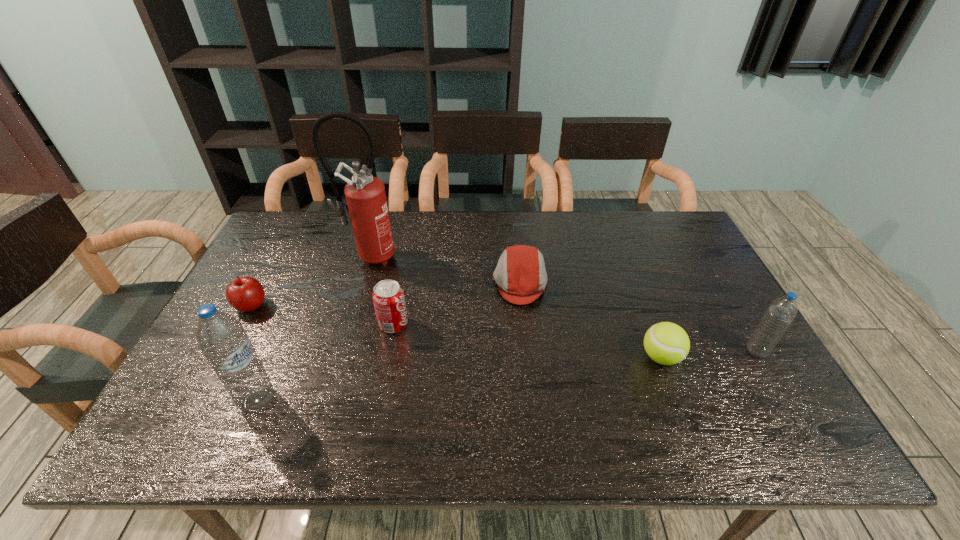
Where is `free space between the apple and the fire extinguisher`? free space between the apple and the fire extinguisher is located at coordinates (310, 281).

Locate an element on the screen. The height and width of the screenshot is (540, 960). free area in between the soda and the fifth object from left to right is located at coordinates (457, 303).

Locate an element on the screen. empty location between the rightmost object and the cap is located at coordinates (638, 317).

This screenshot has height=540, width=960. I want to click on free area in between the cap and the rightmost object, so click(638, 317).

Locate an element on the screen. free spot between the shorter water bottle and the second object from left to right is located at coordinates (507, 376).

Where is `unoccupied area between the tallest object and the tennis ball`? unoccupied area between the tallest object and the tennis ball is located at coordinates (516, 307).

Locate an element on the screen. free space between the soda and the right water bottle is located at coordinates (575, 338).

Locate an element on the screen. This screenshot has height=540, width=960. blank region between the sixth object from left to right and the second tallest object is located at coordinates (460, 379).

You are a GUI agent. You are given a task and a screenshot of the screen. Output one action in this format:
    pyautogui.click(x=<x>, y=<y>)
    Task: Click on the fourth closest object relative to the farther water bottle
    This screenshot has width=960, height=540.
    Given the screenshot: What is the action you would take?
    pyautogui.click(x=365, y=194)

Identify the location of object that is the sixth nearest to the soda. (781, 312).